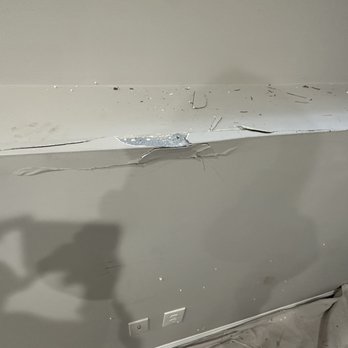
Where is `phone`? phone is located at coordinates (67, 238).